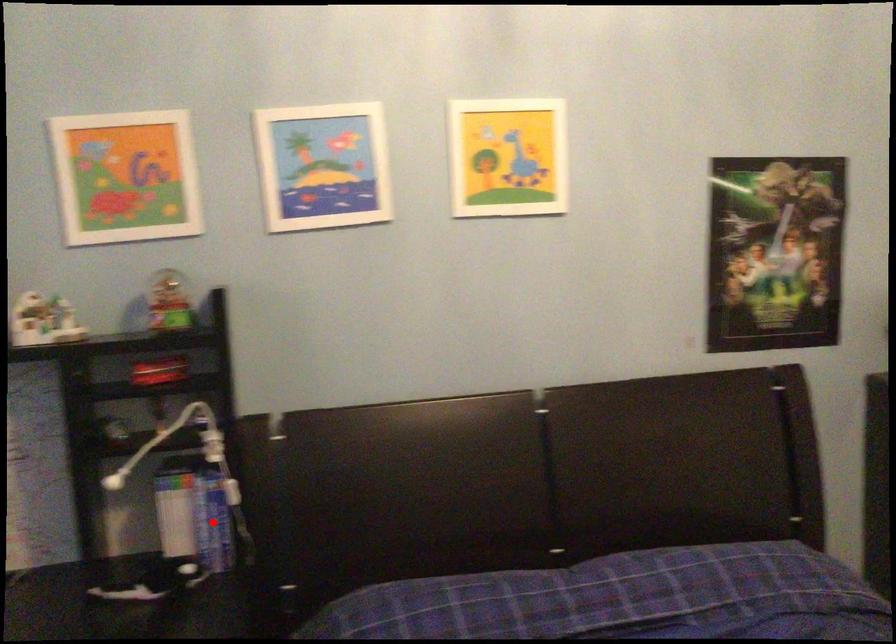
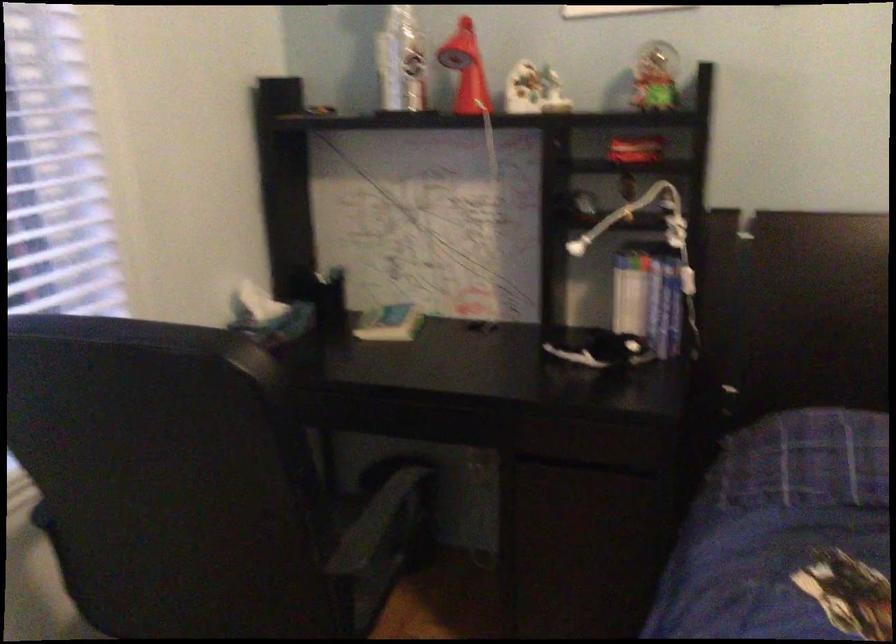
Find the pixel in the second image that matches the highlighted location in the first image.

(664, 307)